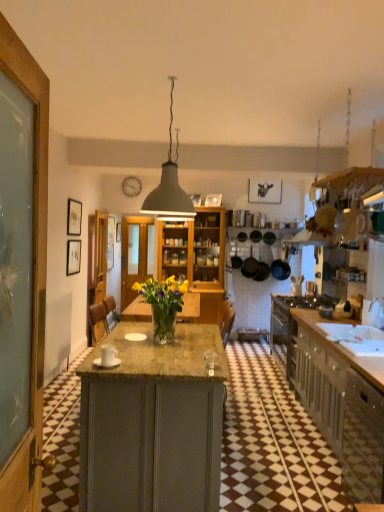
Question: Is black matte frying pans at center, marked as the second kitchen appliance in a left-to-right arrangement, behind matte gray lampshade at center?

Choices:
 (A) no
 (B) yes

Answer: (B)

Question: Is black matte frying pans at center, marked as the second kitchen appliance in a left-to-right arrangement, bigger than matte gray lampshade at center?

Choices:
 (A) yes
 (B) no

Answer: (B)

Question: Is black matte frying pans at center, marked as the second kitchen appliance in a left-to-right arrangement, completely or partially outside of matte gray lampshade at center?

Choices:
 (A) yes
 (B) no

Answer: (A)

Question: Does black matte frying pans at center, marked as the second kitchen appliance in a left-to-right arrangement, contain matte gray lampshade at center?

Choices:
 (A) no
 (B) yes

Answer: (A)

Question: Is black matte frying pans at center, which is the 2th kitchen appliance from right to left, shorter than matte gray lampshade at center?

Choices:
 (A) yes
 (B) no

Answer: (A)

Question: Is matte gray cabinetry at right wider or thinner than matte black frying pan at center, acting as the third kitchen appliance starting from the right?

Choices:
 (A) thin
 (B) wide

Answer: (B)

Question: From the image's perspective, relative to matte black frying pan at center, arranged as the first kitchen appliance when viewed from the left, is matte gray cabinetry at right above or below?

Choices:
 (A) below
 (B) above

Answer: (A)

Question: From their relative heights in the image, would you say matte gray cabinetry at right is taller or shorter than matte black frying pan at center, arranged as the first kitchen appliance when viewed from the left?

Choices:
 (A) short
 (B) tall

Answer: (B)

Question: In the image, is matte gray cabinetry at right positioned in front of or behind matte black frying pan at center, acting as the third kitchen appliance starting from the right?

Choices:
 (A) behind
 (B) front

Answer: (B)

Question: From a real-world perspective, is translucent glass vase at center positioned above or below matte black frying pan at center, acting as the third kitchen appliance starting from the right?

Choices:
 (A) above
 (B) below

Answer: (B)

Question: Would you say translucent glass vase at center is to the left or to the right of matte black frying pan at center, acting as the third kitchen appliance starting from the right, in the picture?

Choices:
 (A) right
 (B) left

Answer: (B)

Question: From their relative heights in the image, would you say translucent glass vase at center is taller or shorter than matte black frying pan at center, acting as the third kitchen appliance starting from the right?

Choices:
 (A) short
 (B) tall

Answer: (A)

Question: Looking at the image, does translucent glass vase at center seem bigger or smaller compared to matte black frying pan at center, acting as the third kitchen appliance starting from the right?

Choices:
 (A) small
 (B) big

Answer: (B)

Question: Looking at their shapes, would you say wooden picture frame at center, the 3th picture frame viewed from the front, is wider or thinner than matte gray lampshade at center?

Choices:
 (A) thin
 (B) wide

Answer: (A)

Question: Is wooden picture frame at center, the 3th picture frame viewed from the front, bigger or smaller than matte gray lampshade at center?

Choices:
 (A) big
 (B) small

Answer: (B)